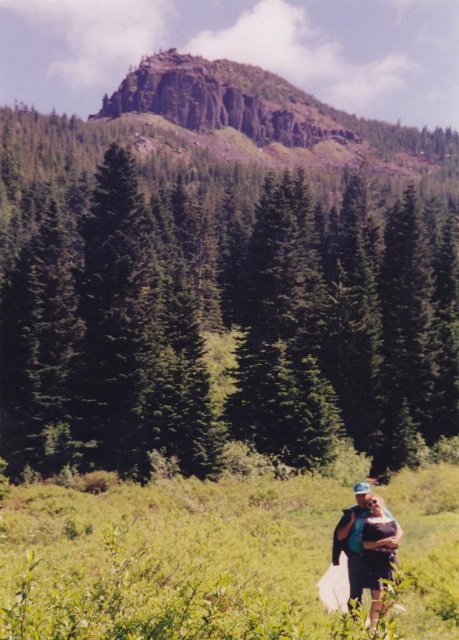
Is green matte tree at center to the left of matte blue shirt at lower right from the viewer's perspective?

Indeed, green matte tree at center is positioned on the left side of matte blue shirt at lower right.

This screenshot has width=459, height=640. What do you see at coordinates (218, 298) in the screenshot?
I see `green matte tree at center` at bounding box center [218, 298].

Image resolution: width=459 pixels, height=640 pixels. Find the location of `green matte tree at center`. green matte tree at center is located at coordinates [x=218, y=298].

Is green grassy field at lower center further to the viewer compared to matte blue shirt at lower right?

No, green grassy field at lower center is in front of matte blue shirt at lower right.

The width and height of the screenshot is (459, 640). What do you see at coordinates (173, 563) in the screenshot?
I see `green grassy field at lower center` at bounding box center [173, 563].

At what (x,y) coordinates should I click in order to perform the action: click on green grassy field at lower center. Please return your answer as a coordinate pair (x, y). Looking at the image, I should click on (173, 563).

Does green matte tree at center have a greater width compared to green grassy field at lower center?

Yes, green matte tree at center is wider than green grassy field at lower center.

Identify the location of green matte tree at center. (218, 298).

Measure the distance between green matte tree at center and camera.

They are 163.41 feet apart.

Where is `green matte tree at center`? This screenshot has width=459, height=640. green matte tree at center is located at coordinates (218, 298).